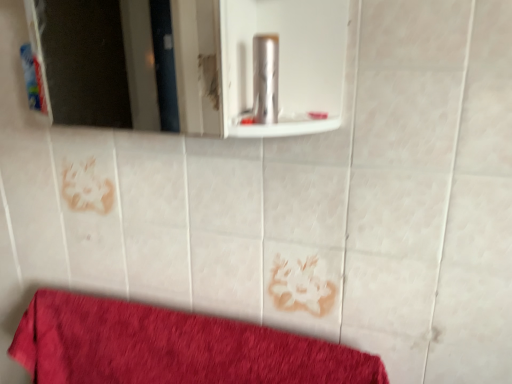
Question: In terms of size, does metallic silver canister at center, placed as the 2th toiletry when sorted from back to front, appear bigger or smaller than white glossy mirror at upper center?

Choices:
 (A) big
 (B) small

Answer: (B)

Question: Considering the positions of metallic silver canister at center, placed as the 2th toiletry when sorted from back to front, and white glossy mirror at upper center in the image, is metallic silver canister at center, placed as the 2th toiletry when sorted from back to front, wider or thinner than white glossy mirror at upper center?

Choices:
 (A) wide
 (B) thin

Answer: (B)

Question: Estimate the real-world distances between objects in this image. Which object is closer to the white glossy mirror at upper center?

Choices:
 (A) blue plastic toothpaste tube at left, which ranks as the second toiletry in right-to-left order
 (B) metallic silver canister at center, which is the 1th toiletry from right to left
 (C) red cotton towel at lower left

Answer: (A)

Question: Estimate the real-world distances between objects in this image. Which object is farther from the metallic silver canister at center, the 1th toiletry when ordered from front to back?

Choices:
 (A) white glossy mirror at upper center
 (B) red cotton towel at lower left
 (C) blue plastic toothpaste tube at left, which ranks as the second toiletry in right-to-left order

Answer: (A)